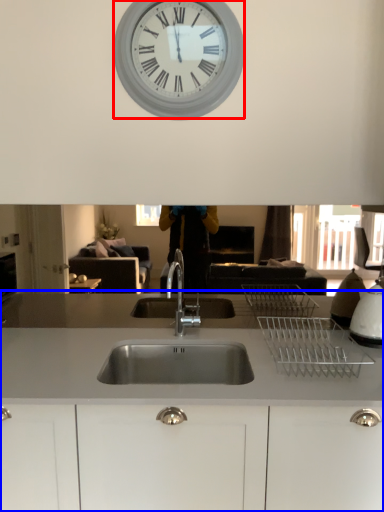
Question: Which point is further to the camera, wall clock (highlighted by a red box) or countertop (highlighted by a blue box)?

Choices:
 (A) wall clock
 (B) countertop

Answer: (A)